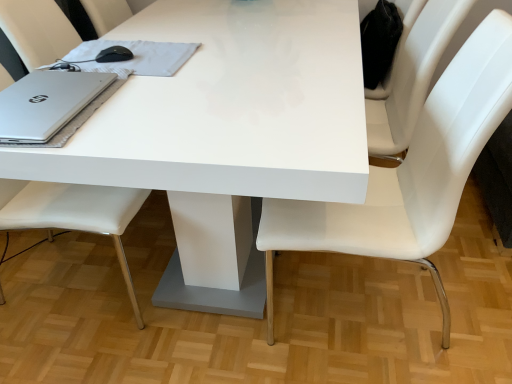
Where is `free spot below white leather chair at left, which appears as the first chair when viewed from the left (from a real-world perspective)`? The width and height of the screenshot is (512, 384). free spot below white leather chair at left, which appears as the first chair when viewed from the left (from a real-world perspective) is located at coordinates (72, 273).